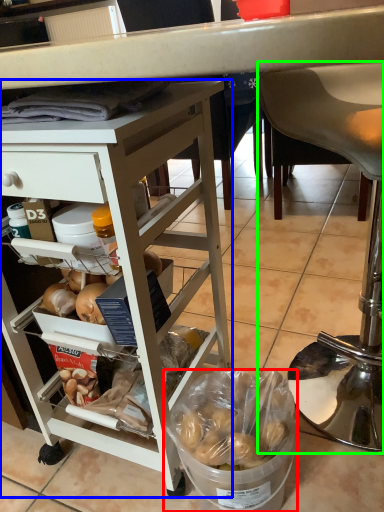
Question: Considering the real-world distances, which object is closest to bowl (highlighted by a red box)? desk (highlighted by a blue box) or chair (highlighted by a green box).

Choices:
 (A) desk
 (B) chair

Answer: (A)